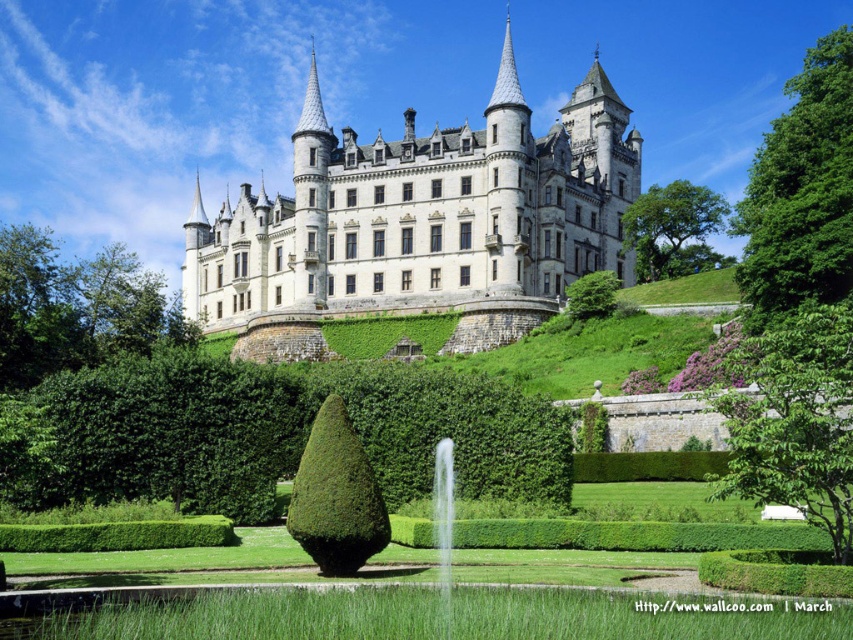
You are standing in the garden looking towards the castle. Which object is closer to you, the white stone castle at center or the green leafy hedge at center?

The green leafy hedge at center is closer to you because the white stone castle at center is further away.

Based on the photo, you are a landscape architect designing a new garden layout. You need to place a new statue exactly halfway between the white stone castle at center and the green leafy hedge at center. Given their sizes, will the statue fit without overlapping either structure?

The white stone castle at center is wider than the green leafy hedge at center. Since the statue is placed halfway between them, the distance between the two structures must be considered. However, the question does not provide specific measurements of the distance between them or the statue size. Without this information, it is impossible to determine if the statue will fit without overlapping. Please provide more details about the distance between the two objects and the statue dimensions.